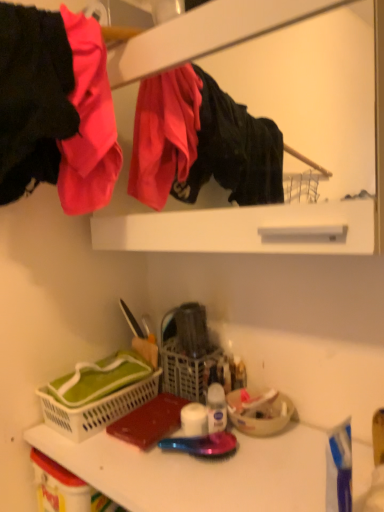
What is the approximate width of white matte toilet paper at center?

white matte toilet paper at center is 2.13 inches wide.

Identify the location of transparent plastic spray bottle at center. This screenshot has height=512, width=384. (216, 408).

The image size is (384, 512). Describe the element at coordinates (216, 408) in the screenshot. I see `transparent plastic spray bottle at center` at that location.

The image size is (384, 512). Find the location of `matte black jacket at upper left`. matte black jacket at upper left is located at coordinates (55, 109).

Image resolution: width=384 pixels, height=512 pixels. What do you see at coordinates (96, 408) in the screenshot? I see `white plastic basket at lower left` at bounding box center [96, 408].

What is the approximate height of white plastic counter top at lower center?

white plastic counter top at lower center is 0.71 inches tall.

In order to face matte white medicine cabinet at upper center, should I rotate leftwards or rightwards?

You should look right and rotate roughly 3.737 degrees.

The image size is (384, 512). Find the location of `white matte toilet paper at center`. white matte toilet paper at center is located at coordinates (194, 420).

Between white matte toilet paper at center and white plastic basket at lower left, which one appears on the right side from the viewer's perspective?

white matte toilet paper at center.

Which object is closer to the camera taking this photo, white matte toilet paper at center or white plastic basket at lower left?

white plastic basket at lower left is in front.

Based on their sizes in the image, would you say white matte toilet paper at center is bigger or smaller than white plastic basket at lower left?

In the image, white matte toilet paper at center appears to be smaller than white plastic basket at lower left.

Is white plastic basket at lower left inside white matte toilet paper at center?

No, white plastic basket at lower left is located outside of white matte toilet paper at center.

How many degrees apart are the facing directions of white plastic basket at lower left and matte white medicine cabinet at upper center?

They differ by 0.11 degrees in their facing directions.

Is white plastic basket at lower left thinner than matte white medicine cabinet at upper center?

No, white plastic basket at lower left is not thinner than matte white medicine cabinet at upper center.

Based on the photo, from the image's perspective, does white plastic basket at lower left appear higher than matte white medicine cabinet at upper center?

No, from the image's perspective, white plastic basket at lower left is not over matte white medicine cabinet at upper center.

Looking at the image, does white plastic basket at lower left seem bigger or smaller compared to matte white medicine cabinet at upper center?

Clearly, white plastic basket at lower left is smaller in size than matte white medicine cabinet at upper center.

From a real-world perspective, which is physically above, white plastic counter top at lower center or matte black jacket at upper left?

A: In real-world perspective, matte black jacket at upper left is above.

From the image's perspective, is white plastic counter top at lower center under matte black jacket at upper left?

Yes, from the image's perspective, white plastic counter top at lower center is beneath matte black jacket at upper left.

Is white plastic counter top at lower center not inside matte black jacket at upper left?

Indeed, white plastic counter top at lower center is completely outside matte black jacket at upper left.

Is point (9, 131) behind point (304, 426)?

No.

Looking at the image, does matte black jacket at upper left seem bigger or smaller compared to white plastic counter top at lower center?

In the image, matte black jacket at upper left appears to be larger than white plastic counter top at lower center.

Based on their positions, is matte black jacket at upper left located to the left or right of white plastic counter top at lower center?

matte black jacket at upper left is to the left of white plastic counter top at lower center.

Who is more distant, matte black jacket at upper left or white plastic counter top at lower center?

matte black jacket at upper left is behind.

Does white matte toilet paper at center have a lesser height compared to transparent plastic spray bottle at center?

Yes.

Considering the positions of point (196, 404) and point (216, 382), is point (196, 404) closer or farther from the camera than point (216, 382)?

Point (196, 404) is closer to the camera than point (216, 382).

Identify the location of toilet paper located behind the transparent plastic spray bottle at center. coord(194,420).

Between white matte toilet paper at center and transparent plastic spray bottle at center, which one appears on the left side from the viewer's perspective?

Positioned to the left is white matte toilet paper at center.

Is matte white medicine cabinet at upper center facing towards white plastic basket at lower left?

No, matte white medicine cabinet at upper center is not aimed at white plastic basket at lower left.

Can you confirm if matte white medicine cabinet at upper center is thinner than white plastic basket at lower left?

Indeed, matte white medicine cabinet at upper center has a lesser width compared to white plastic basket at lower left.

Locate an element on the screen. This screenshot has height=512, width=384. medicine cabinet above the white plastic basket at lower left (from the image's perspective) is located at coordinates (288, 143).

Would you say matte white medicine cabinet at upper center is outside white plastic basket at lower left?

Yes, matte white medicine cabinet at upper center is outside of white plastic basket at lower left.

From a real-world perspective, which object stands above the other?

matte white medicine cabinet at upper center, from a real-world perspective.

How many degrees apart are the facing directions of white matte toilet paper at center and matte white medicine cabinet at upper center?

They differ by 34.5 degrees in their facing directions.

From the picture: Relative to matte white medicine cabinet at upper center, is white matte toilet paper at center in front or behind?

Visually, white matte toilet paper at center is located behind matte white medicine cabinet at upper center.

Would you consider white matte toilet paper at center to be distant from matte white medicine cabinet at upper center?

Yes, white matte toilet paper at center is far from matte white medicine cabinet at upper center.

Where is `toilet paper behind the white plastic basket at lower left`? toilet paper behind the white plastic basket at lower left is located at coordinates (194, 420).

You are a GUI agent. You are given a task and a screenshot of the screen. Output one action in this format:
    pyautogui.click(x=<x>, y=<y>)
    Task: Click on the basket lying below the matte white medicine cabinet at upper center (from the image's perspective)
    
    Given the screenshot: What is the action you would take?
    pyautogui.click(x=96, y=408)

From the picture: Looking at the image, which one is located closer to white plastic counter top at lower center, transparent plastic spray bottle at center or white matte toilet paper at center?

white matte toilet paper at center is positioned closer to the anchor white plastic counter top at lower center.

When comparing their distances from white matte toilet paper at center, does matte white medicine cabinet at upper center or transparent plastic spray bottle at center seem further?

matte white medicine cabinet at upper center lies further to white matte toilet paper at center than the other object.

Looking at this image, from the image, which object appears to be farther from white matte toilet paper at center, transparent plastic spray bottle at center or matte white medicine cabinet at upper center?

matte white medicine cabinet at upper center.

From the image, which object appears to be farther from white matte toilet paper at center, white plastic basket at lower left or matte black jacket at upper left?

The object further to white matte toilet paper at center is matte black jacket at upper left.

Estimate the real-world distances between objects in this image. Which object is closer to white matte toilet paper at center, transparent plastic spray bottle at center or white plastic basket at lower left?

transparent plastic spray bottle at center lies closer to white matte toilet paper at center than the other object.

From the image, which object appears to be nearer to white plastic counter top at lower center, white matte toilet paper at center or white plastic basket at lower left?

white matte toilet paper at center is closer to white plastic counter top at lower center.

In the scene shown: When comparing their distances from matte white medicine cabinet at upper center, does transparent plastic spray bottle at center or white plastic counter top at lower center seem further?

transparent plastic spray bottle at center is positioned further to the anchor matte white medicine cabinet at upper center.

Considering their positions, is transparent plastic spray bottle at center positioned further to white plastic basket at lower left than matte black jacket at upper left?

Based on the image, matte black jacket at upper left appears to be further to white plastic basket at lower left.

Where is `basket between white plastic counter top at lower center and white matte toilet paper at center along the z-axis`? This screenshot has width=384, height=512. basket between white plastic counter top at lower center and white matte toilet paper at center along the z-axis is located at coordinates (96, 408).

What are the coordinates of `toilet paper between white plastic basket at lower left and transparent plastic spray bottle at center` in the screenshot? It's located at pos(194,420).

Where is `basket between white plastic counter top at lower center and transparent plastic spray bottle at center in the front-back direction`? This screenshot has width=384, height=512. basket between white plastic counter top at lower center and transparent plastic spray bottle at center in the front-back direction is located at coordinates (96, 408).

This screenshot has width=384, height=512. Identify the location of basket between matte white medicine cabinet at upper center and transparent plastic spray bottle at center from top to bottom. (96, 408).